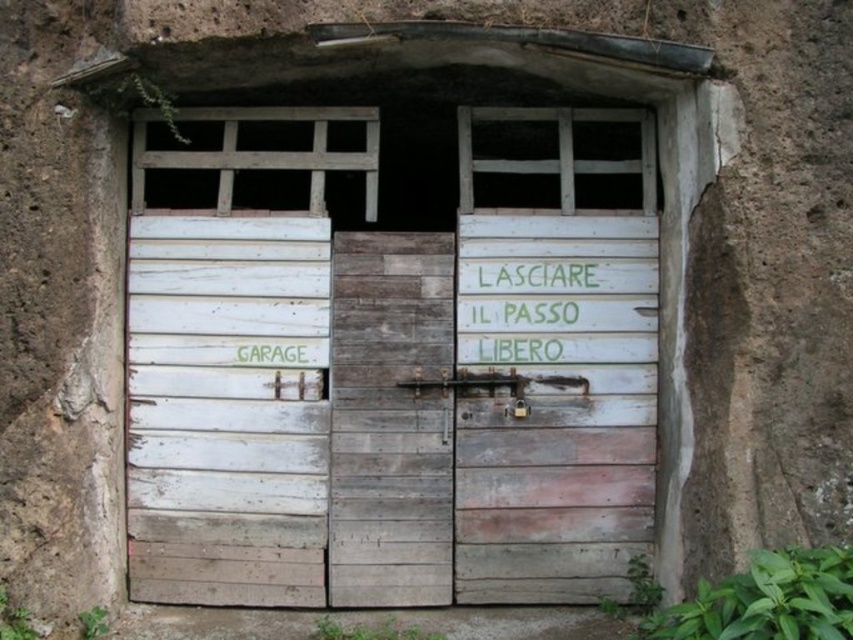
Question: Which object is the closest to the white weathered wood door at left?

Choices:
 (A) white painted wood at center
 (B) white weathered wood door at center
 (C) white weathered wood garage door at center

Answer: (C)

Question: Can you confirm if white weathered wood door at center is positioned to the right of green painted wood sign at center?

Choices:
 (A) yes
 (B) no

Answer: (A)

Question: Estimate the real-world distances between objects in this image. Which object is farther from the green painted wood sign at center?

Choices:
 (A) white weathered wood door at left
 (B) weathered wood door at center
 (C) white weathered wood garage door at center

Answer: (A)

Question: Does white weathered wood door at center lie in front of weathered wood door at center?

Choices:
 (A) no
 (B) yes

Answer: (A)

Question: Is white weathered wood door at center further to camera compared to green painted wood sign at center?

Choices:
 (A) no
 (B) yes

Answer: (B)

Question: Which object appears closest to the camera in this image?

Choices:
 (A) white painted wood at center
 (B) green painted wood sign at center
 (C) white weathered wood door at center

Answer: (A)